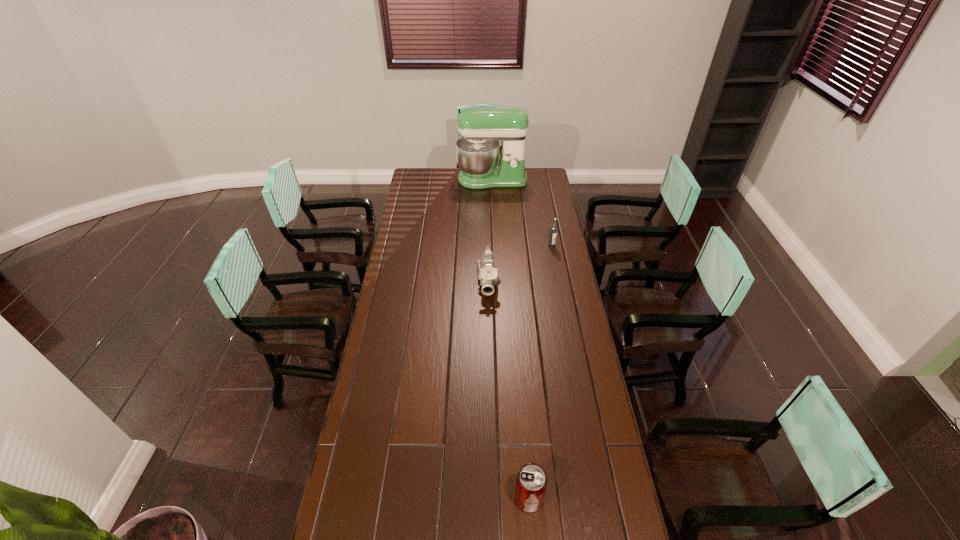
The image size is (960, 540). In order to click on mixer in this screenshot , I will do `click(477, 150)`.

Where is `the tallest object`? This screenshot has width=960, height=540. the tallest object is located at coordinates (477, 150).

This screenshot has width=960, height=540. In order to click on vodka in this screenshot , I will do `click(553, 230)`.

The height and width of the screenshot is (540, 960). In order to click on the second farthest object in this screenshot , I will do `click(553, 230)`.

At what (x,y) coordinates should I click in order to perform the action: click on camcorder. Please return your answer as a coordinate pair (x, y). The image size is (960, 540). Looking at the image, I should click on (487, 274).

Locate an element on the screen. The image size is (960, 540). pop soda is located at coordinates (531, 482).

Find the location of a particular element. This screenshot has width=960, height=540. vacant space located 0.210m on the controls of the tallest object is located at coordinates (492, 211).

The image size is (960, 540). I want to click on free space located on the label of the vodka, so point(558,278).

Identify the location of vacant space situated 0.220m on the front-facing side of the camcorder. Image resolution: width=960 pixels, height=540 pixels. (490, 335).

Image resolution: width=960 pixels, height=540 pixels. Identify the location of free point located 0.200m on the left of the nearest object. [x=450, y=498].